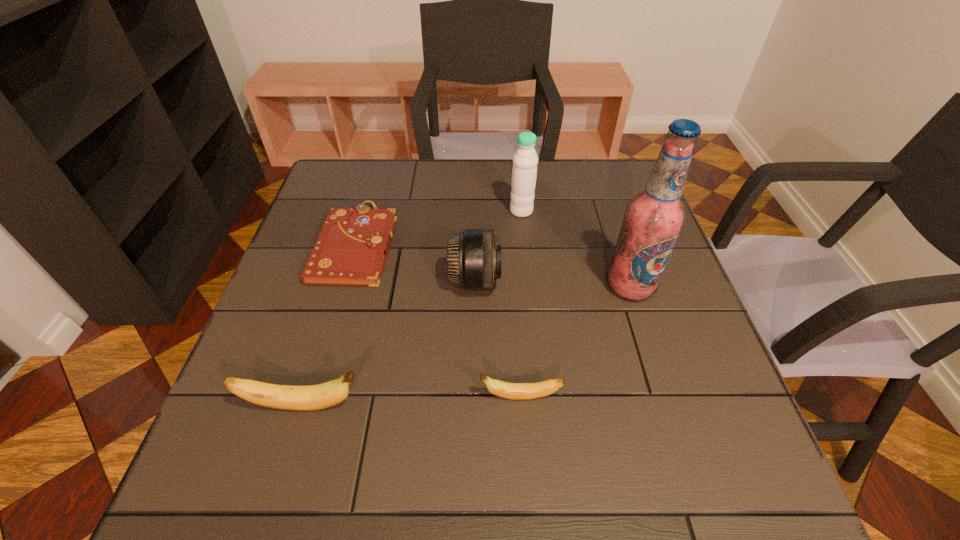
Locate an element on the screen. Image resolution: width=960 pixels, height=540 pixels. the taller banana is located at coordinates (289, 397).

This screenshot has width=960, height=540. In order to click on the left banana in this screenshot , I will do `click(289, 397)`.

Image resolution: width=960 pixels, height=540 pixels. I want to click on the right banana, so click(x=516, y=391).

The width and height of the screenshot is (960, 540). Find the location of `the fifth tallest object`. the fifth tallest object is located at coordinates (516, 391).

You are a GUI agent. You are given a task and a screenshot of the screen. Output one action in this format:
    pyautogui.click(x=<x>, y=<y>)
    Task: Click on the fifth shortest object
    The image size is (960, 540).
    Given the screenshot: What is the action you would take?
    pyautogui.click(x=524, y=171)

The height and width of the screenshot is (540, 960). I want to click on the third tallest object, so click(474, 258).

Where is `notebook`? Image resolution: width=960 pixels, height=540 pixels. notebook is located at coordinates (351, 249).

What are the coordinates of `the tallest object` in the screenshot? It's located at (653, 219).

This screenshot has width=960, height=540. What are the coordinates of `the rightmost object` in the screenshot? It's located at (x=653, y=219).

Locate an element on the screen. The height and width of the screenshot is (540, 960). blank area located 0.390m at the stem of the third shortest object is located at coordinates (578, 407).